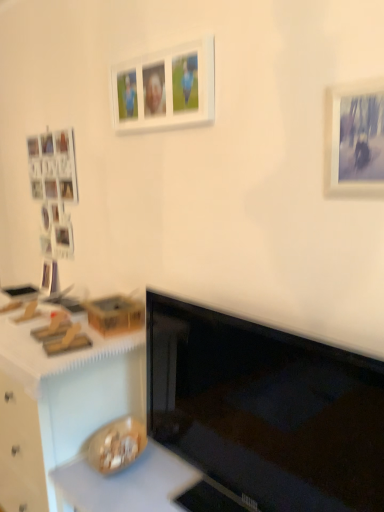
Question: Is white matte picture frame at upper center, which is the 2th picture frame from bottom to top, to the left of black glossy monitor at center from the viewer's perspective?

Choices:
 (A) yes
 (B) no

Answer: (A)

Question: Is white matte picture frame at upper center, which is the 2th picture frame from bottom to top, bigger than black glossy monitor at center?

Choices:
 (A) no
 (B) yes

Answer: (A)

Question: Considering the relative positions of white matte picture frame at upper center, acting as the first picture frame starting from the back, and black glossy monitor at center in the image provided, is white matte picture frame at upper center, acting as the first picture frame starting from the back, behind black glossy monitor at center?

Choices:
 (A) yes
 (B) no

Answer: (A)

Question: Can we say white matte picture frame at upper center, which is the 2th picture frame from bottom to top, lies outside black glossy monitor at center?

Choices:
 (A) no
 (B) yes

Answer: (B)

Question: Could you tell me if white matte picture frame at upper center, the 2th picture frame viewed from the front, is turned towards black glossy monitor at center?

Choices:
 (A) no
 (B) yes

Answer: (A)

Question: Relative to white matte picture frame at upper center, the 2th picture frame viewed from the front, is white matte counter top at lower left, arranged as the first counter top when viewed from the top, in front or behind?

Choices:
 (A) front
 (B) behind

Answer: (B)

Question: Considering the positions of white matte counter top at lower left, arranged as the first counter top when viewed from the top, and white matte picture frame at upper center, which is the 2th picture frame from bottom to top, in the image, is white matte counter top at lower left, arranged as the first counter top when viewed from the top, bigger or smaller than white matte picture frame at upper center, which is the 2th picture frame from bottom to top,?

Choices:
 (A) small
 (B) big

Answer: (B)

Question: From a real-world perspective, is white matte counter top at lower left, arranged as the first counter top when viewed from the top, above or below white matte picture frame at upper center, the first picture frame when ordered from top to bottom?

Choices:
 (A) below
 (B) above

Answer: (A)

Question: Is white matte counter top at lower left, arranged as the first counter top when viewed from the top, wider or thinner than white matte picture frame at upper center, which is the 2th picture frame in right-to-left order?

Choices:
 (A) wide
 (B) thin

Answer: (A)

Question: Looking at their shapes, would you say wooden desk at lower left is wider or thinner than white matte picture frame at upper center, the 2th picture frame viewed from the front?

Choices:
 (A) thin
 (B) wide

Answer: (B)

Question: From a real-world perspective, is wooden desk at lower left positioned above or below white matte picture frame at upper center, which is the 2th picture frame from bottom to top?

Choices:
 (A) above
 (B) below

Answer: (B)

Question: In the image, is wooden desk at lower left positioned in front of or behind white matte picture frame at upper center, which is the 2th picture frame in right-to-left order?

Choices:
 (A) behind
 (B) front

Answer: (A)

Question: Would you say wooden desk at lower left is to the left or to the right of white matte picture frame at upper center, the first picture frame when ordered from top to bottom, in the picture?

Choices:
 (A) right
 (B) left

Answer: (B)

Question: Visually, is wooden desk at lower left positioned to the left or to the right of matte white picture frame at upper right, which is the 1th picture frame from bottom to top?

Choices:
 (A) left
 (B) right

Answer: (A)

Question: Is wooden desk at lower left inside the boundaries of matte white picture frame at upper right, positioned as the second picture frame in top-to-bottom order, or outside?

Choices:
 (A) outside
 (B) inside

Answer: (A)